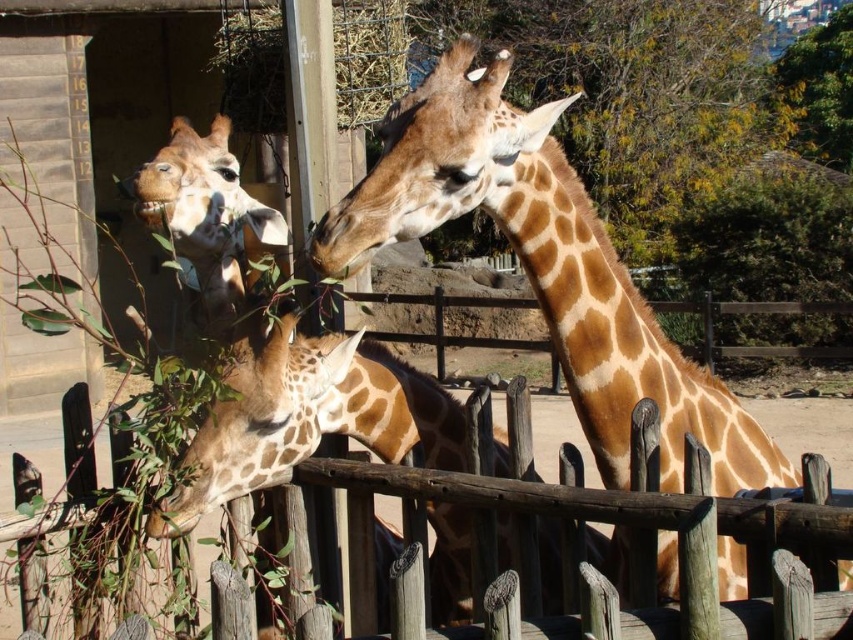
You are a zookeeper trying to feed the spotted brown giraffe at center. You have a branch of leaves. Where should you position yourself relative to the green leafy tree at upper center to ensure the giraffe can see you?

You should position yourself behind the green leafy tree at upper center because the spotted brown giraffe at center is behind the green leafy tree at upper center, so placing yourself behind the tree will allow the giraffe to see you as it is also positioned behind the tree.